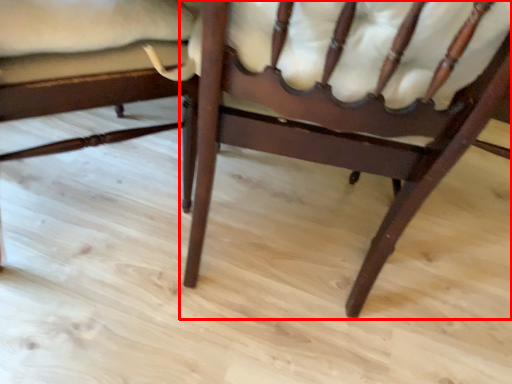
Question: From the image's perspective, where is chair (annotated by the red box) located in relation to chair in the image?

Choices:
 (A) above
 (B) below

Answer: (B)